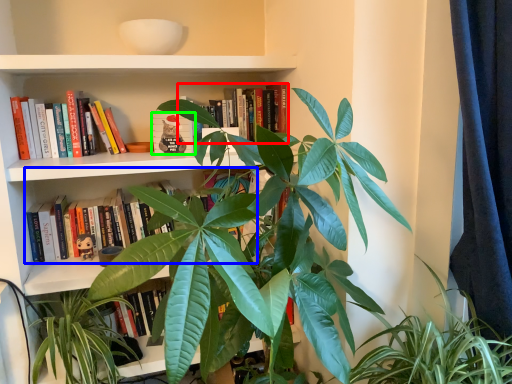
Question: Based on their relative distances, which object is nearer to book (highlighted by a red box)? Choose from book (highlighted by a blue box) and book (highlighted by a green box).

Choices:
 (A) book
 (B) book

Answer: (B)